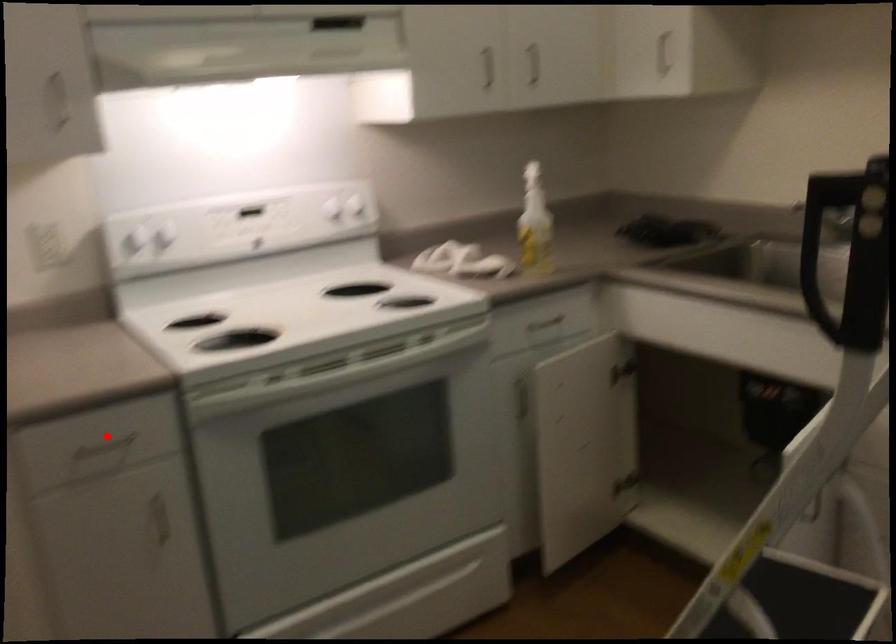
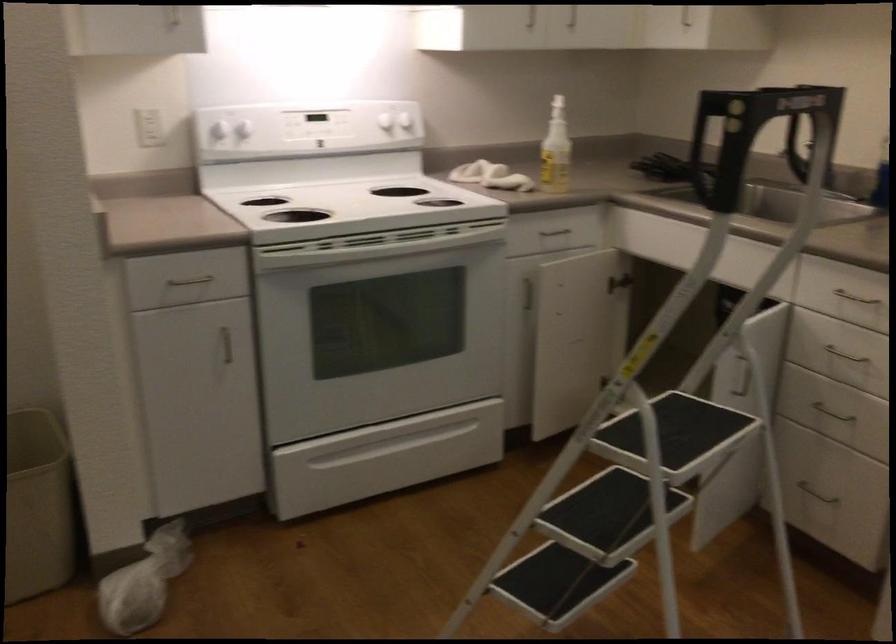
Question: A red point is marked in image1. In image2, is the corresponding 3D point closer to the camera or farther? Reply with the corresponding letter.

Choices:
 (A) The corresponding 3D point is closer.
 (B) The corresponding 3D point is farther.

Answer: (B)